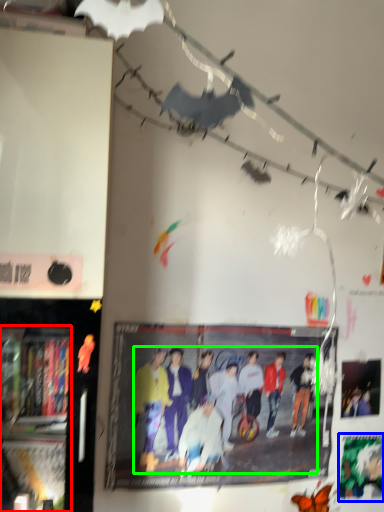
Question: Which is nearer to the bookshelf (highlighted by a red box)? poster page (highlighted by a blue box) or person (highlighted by a green box).

Choices:
 (A) poster page
 (B) person

Answer: (B)